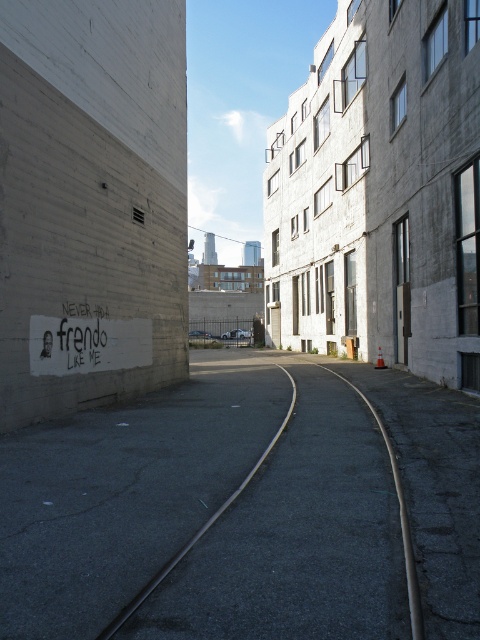
Is black asphalt track at center below white matte text at center?

Correct, black asphalt track at center is located below white matte text at center.

Which is below, black asphalt track at center or white matte text at center?

Positioned lower is black asphalt track at center.

Find the location of a particular element. This screenshot has width=480, height=640. black asphalt track at center is located at coordinates 197,529.